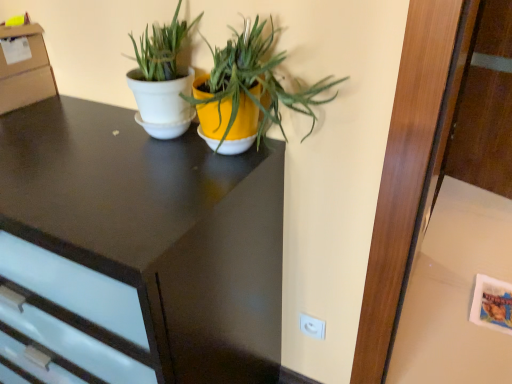
Question: Would you say white glossy table at lower right is to the left or to the right of white plastic electric outlet at lower right in the picture?

Choices:
 (A) right
 (B) left

Answer: (A)

Question: From a real-world perspective, is white glossy table at lower right physically located above or below white plastic electric outlet at lower right?

Choices:
 (A) above
 (B) below

Answer: (B)

Question: Which of these objects is positioned closest to the white glossy pot at center, marked as the second houseplant in a right-to-left arrangement?

Choices:
 (A) matte black desk at center
 (B) white glossy table at lower right
 (C) white glossy pot at center, which is the second houseplant in left-to-right order
 (D) white plastic electric outlet at lower right

Answer: (C)

Question: Estimate the real-world distances between objects in this image. Which object is closer to the matte black desk at center?

Choices:
 (A) white glossy pot at center, the first houseplant from the right
 (B) white glossy pot at center, marked as the second houseplant in a right-to-left arrangement
 (C) white glossy table at lower right
 (D) white plastic electric outlet at lower right

Answer: (A)